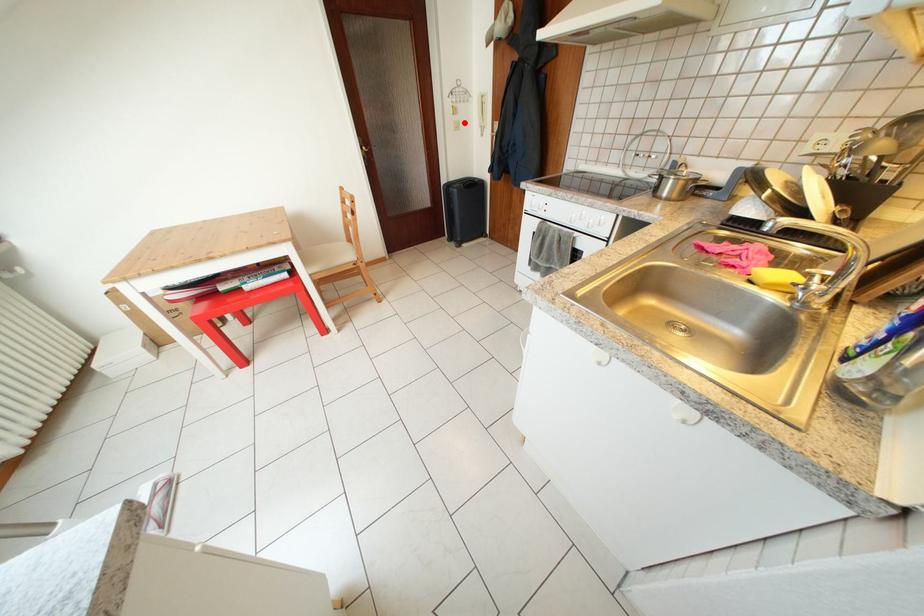
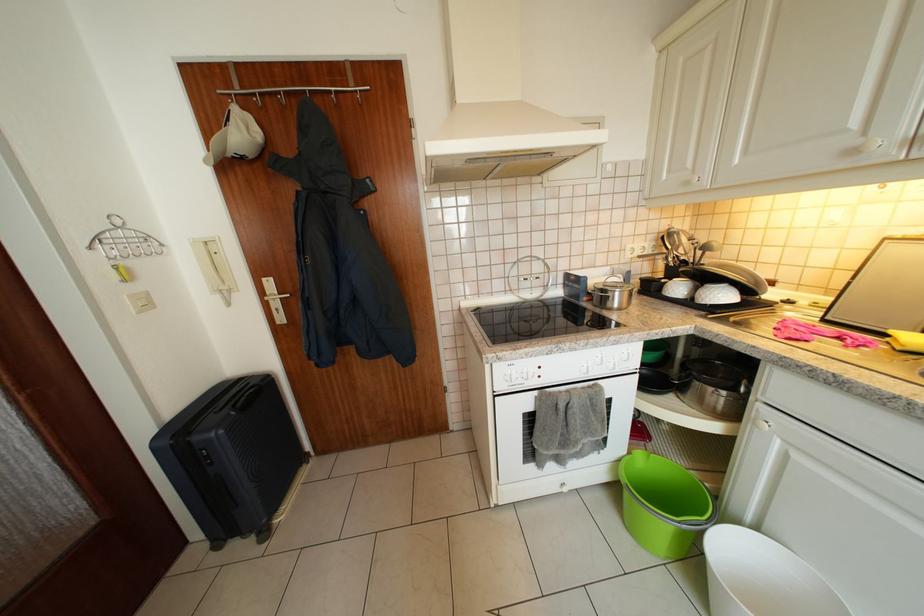
In the second image, find the point that corresponds to the highlighted location in the first image.

(144, 293)